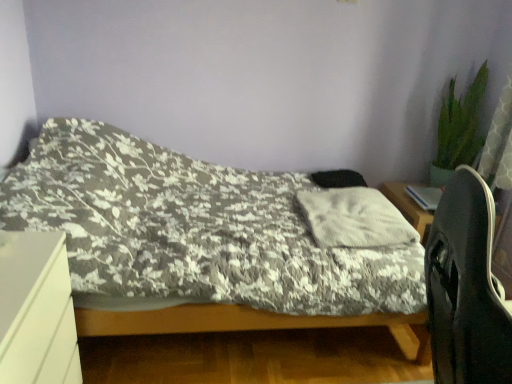
In order to click on fluffy gray blanket at center in this screenshot , I will do `click(199, 243)`.

Describe the element at coordinates (354, 219) in the screenshot. I see `fluffy white pillow at center` at that location.

Describe the element at coordinates (458, 128) in the screenshot. I see `green leafy plant at upper right` at that location.

Locate an element on the screen. This screenshot has height=384, width=512. fluffy gray blanket at center is located at coordinates (199, 243).

Can we say green leafy plant at upper right lies outside fluffy white pillow at center?

green leafy plant at upper right is positioned outside fluffy white pillow at center.

Is green leafy plant at upper right directly adjacent to fluffy white pillow at center?

green leafy plant at upper right is not next to fluffy white pillow at center, and they're not touching.

Can you confirm if green leafy plant at upper right is thinner than fluffy white pillow at center?

Yes.

From the image's perspective, is fluffy gray blanket at center located beneath black matte computer chair at right?

No, from the image's perspective, fluffy gray blanket at center is not beneath black matte computer chair at right.

Considering their positions, is fluffy gray blanket at center located in front of or behind black matte computer chair at right?

fluffy gray blanket at center is positioned farther from the viewer than black matte computer chair at right.

Does fluffy gray blanket at center turn towards black matte computer chair at right?

No, fluffy gray blanket at center is not turned towards black matte computer chair at right.

From a real-world perspective, is fluffy gray blanket at center below black matte computer chair at right?

Correct, in the physical world, fluffy gray blanket at center is lower than black matte computer chair at right.

From a real-world perspective, which is physically above, fluffy white pillow at center or black matte computer chair at right?

black matte computer chair at right.

Measure the distance between fluffy white pillow at center and black matte computer chair at right.

fluffy white pillow at center and black matte computer chair at right are 1.08 meters apart from each other.

Is fluffy white pillow at center turned away from black matte computer chair at right?

No, fluffy white pillow at center's orientation is not away from black matte computer chair at right.

Looking at this image, which is more to the right, fluffy white pillow at center or black matte computer chair at right?

black matte computer chair at right is more to the right.

Can you confirm if green leafy plant at upper right is bigger than white matte desk at lower left?

Actually, green leafy plant at upper right might be smaller than white matte desk at lower left.

From the image's perspective, is green leafy plant at upper right under white matte desk at lower left?

Actually, green leafy plant at upper right appears above white matte desk at lower left in the image.

Considering the sizes of objects green leafy plant at upper right and white matte desk at lower left in the image provided, who is shorter, green leafy plant at upper right or white matte desk at lower left?

With less height is white matte desk at lower left.

Is green leafy plant at upper right inside or outside of white matte desk at lower left?

green leafy plant at upper right is outside white matte desk at lower left.

Who is taller, fluffy white pillow at center or green leafy plant at upper right?

green leafy plant at upper right is taller.

Which object is positioned more to the left, fluffy white pillow at center or green leafy plant at upper right?

fluffy white pillow at center is more to the left.

Identify the location of houseplant located above the fluffy white pillow at center (from a real-world perspective). (458, 128).

From a real-world perspective, does fluffy white pillow at center sit lower than green leafy plant at upper right?

Yes.

Is white matte desk at lower left taller or shorter than black matte computer chair at right?

In the image, white matte desk at lower left appears to be shorter than black matte computer chair at right.

Based on the photo, could you tell me if white matte desk at lower left is facing black matte computer chair at right?

Yes, white matte desk at lower left is facing black matte computer chair at right.

In order to click on desk located behind the black matte computer chair at right in this screenshot , I will do `click(36, 310)`.

Locate an element on the screen. bed in front of the fluffy white pillow at center is located at coordinates (199, 243).

Measure the distance between fluffy white pillow at center and fluffy gray blanket at center.

fluffy white pillow at center and fluffy gray blanket at center are 20.01 inches apart.

Does point (398, 239) appear closer or farther from the camera than point (300, 288)?

Point (398, 239) appears to be farther away from the viewer than point (300, 288).

Can you confirm if fluffy white pillow at center is bigger than fluffy gray blanket at center?

Incorrect, fluffy white pillow at center is not larger than fluffy gray blanket at center.

Find the location of `pillow in front of the green leafy plant at upper right`. pillow in front of the green leafy plant at upper right is located at coordinates (354, 219).

Find the location of a particular element. computer chair below the fluffy gray blanket at center (from the image's perspective) is located at coordinates (466, 287).

Looking at the image, which one is located closer to fluffy gray blanket at center, fluffy white pillow at center or black matte computer chair at right?

Among the two, fluffy white pillow at center is located nearer to fluffy gray blanket at center.

From the image, which object appears to be nearer to fluffy white pillow at center, white matte desk at lower left or fluffy gray blanket at center?

Among the two, fluffy gray blanket at center is located nearer to fluffy white pillow at center.

From the image, which object appears to be farther from white matte desk at lower left, black matte computer chair at right or fluffy gray blanket at center?

The object further to white matte desk at lower left is black matte computer chair at right.

Which object lies further to the anchor point fluffy white pillow at center, black matte computer chair at right or green leafy plant at upper right?

black matte computer chair at right lies further to fluffy white pillow at center than the other object.

Considering their positions, is white matte desk at lower left positioned further to fluffy white pillow at center than black matte computer chair at right?

The object further to fluffy white pillow at center is white matte desk at lower left.

From the image, which object appears to be nearer to white matte desk at lower left, fluffy white pillow at center or green leafy plant at upper right?

fluffy white pillow at center lies closer to white matte desk at lower left than the other object.

Which object lies nearer to the anchor point fluffy gray blanket at center, black matte computer chair at right or fluffy white pillow at center?

fluffy white pillow at center.

Considering their positions, is black matte computer chair at right positioned closer to fluffy gray blanket at center than green leafy plant at upper right?

black matte computer chair at right.

Image resolution: width=512 pixels, height=384 pixels. Find the location of `pillow between fluffy gray blanket at center and green leafy plant at upper right from left to right`. pillow between fluffy gray blanket at center and green leafy plant at upper right from left to right is located at coordinates (354, 219).

Find the location of `bed between white matte desk at lower left and black matte computer chair at right`. bed between white matte desk at lower left and black matte computer chair at right is located at coordinates (199, 243).

Find the location of a particular element. pillow between black matte computer chair at right and green leafy plant at upper right in the front-back direction is located at coordinates (354, 219).

At what (x,y) coordinates should I click in order to perform the action: click on computer chair between white matte desk at lower left and green leafy plant at upper right. Please return your answer as a coordinate pair (x, y). The height and width of the screenshot is (384, 512). Looking at the image, I should click on (466, 287).